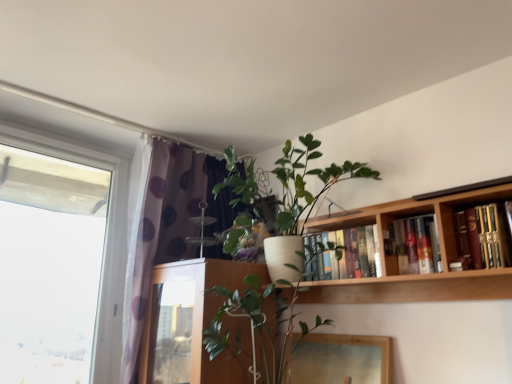
Question: Visually, is hardcover books at upper right, positioned as the first book in front-to-back order, positioned to the left or to the right of hardcover books at upper right, positioned as the 2th book in front-to-back order?

Choices:
 (A) right
 (B) left

Answer: (A)

Question: Considering the positions of hardcover books at upper right, positioned as the first book in front-to-back order, and hardcover books at upper right, the 2th book viewed from the right, in the image, is hardcover books at upper right, positioned as the first book in front-to-back order, wider or thinner than hardcover books at upper right, the 2th book viewed from the right,?

Choices:
 (A) wide
 (B) thin

Answer: (B)

Question: Based on their relative distances, which object is farther from the white ceramic pot at center, arranged as the first houseplant when ordered from the bottom?

Choices:
 (A) wooden bookshelf at upper right
 (B) hardcover books at upper center, which appears as the third book when viewed from the right
 (C) hardcover books at upper right, positioned as the 2th book in front-to-back order
 (D) white matte pot at upper center, the first houseplant from the top
 (E) wooden picture frame at lower center

Answer: (C)

Question: Which of these objects is positioned closest to the transparent glass window at left?

Choices:
 (A) wooden picture frame at lower center
 (B) white ceramic pot at center, arranged as the first houseplant when ordered from the bottom
 (C) wooden bookshelf at upper right
 (D) hardcover books at upper right, positioned as the 2th book in front-to-back order
 (E) hardcover books at upper right, placed as the 3th book when sorted from left to right

Answer: (B)